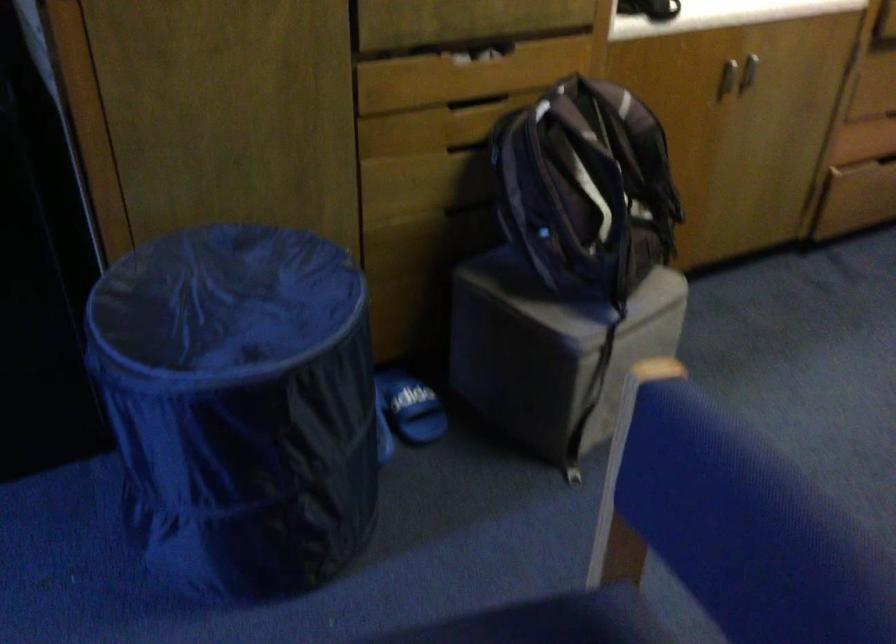
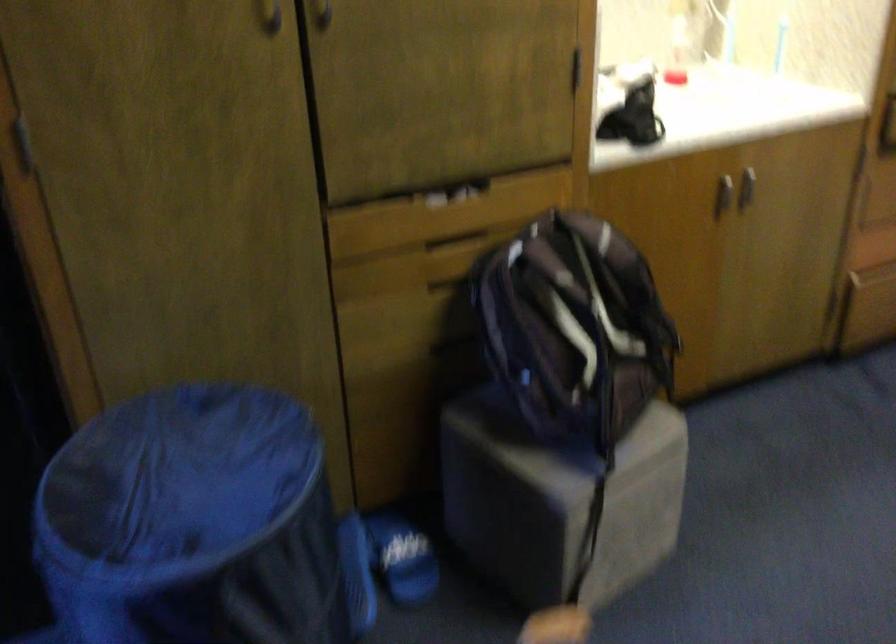
Find the pixel in the second image that matches [728,73] in the first image.

(722, 194)